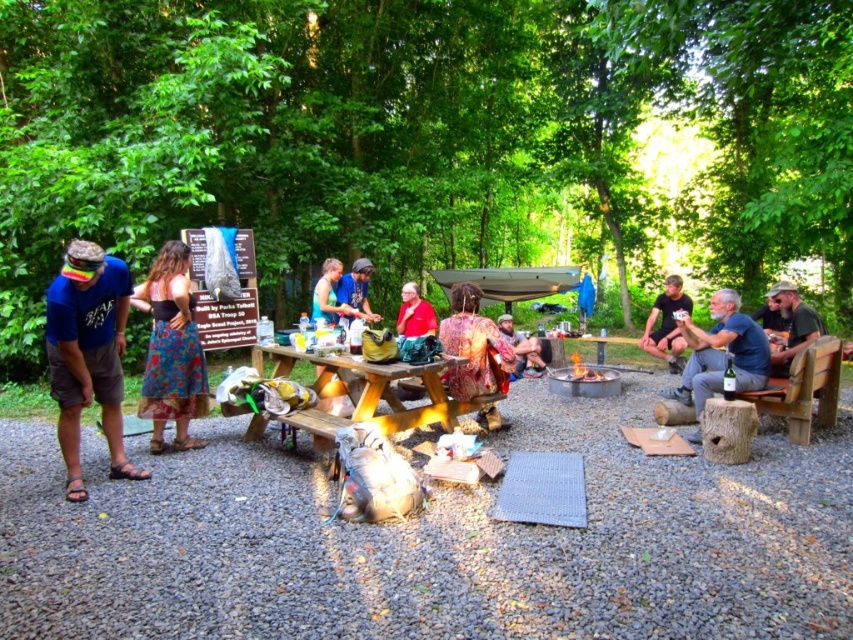
Which is above, floral fabric skirt at center or black t-shirt at right?

Positioned higher is black t-shirt at right.

Who is more distant from viewer, (149, 310) or (682, 346)?

The point (682, 346) is more distant.

At what (x,y) coordinates should I click in order to perform the action: click on floral fabric skirt at center. Please return your answer as a coordinate pair (x, y). Image resolution: width=853 pixels, height=640 pixels. Looking at the image, I should click on (171, 349).

Does wooden picnic table at center have a smaller size compared to denim jacket at center?

Actually, wooden picnic table at center might be larger than denim jacket at center.

At what (x,y) coordinates should I click in order to perform the action: click on wooden picnic table at center. Please return your answer as a coordinate pair (x, y). This screenshot has height=640, width=853. Looking at the image, I should click on (363, 392).

Where is `wooden picnic table at center`? The height and width of the screenshot is (640, 853). wooden picnic table at center is located at coordinates (363, 392).

Where is `wooden picnic table at center`? wooden picnic table at center is located at coordinates (363, 392).

Is blue fabric shirt at left wider than wooden picnic table at center?

No, blue fabric shirt at left is not wider than wooden picnic table at center.

Between point (86, 396) and point (248, 422), which one is positioned behind?

Positioned behind is point (248, 422).

Identify the location of blue fabric shirt at left. (88, 353).